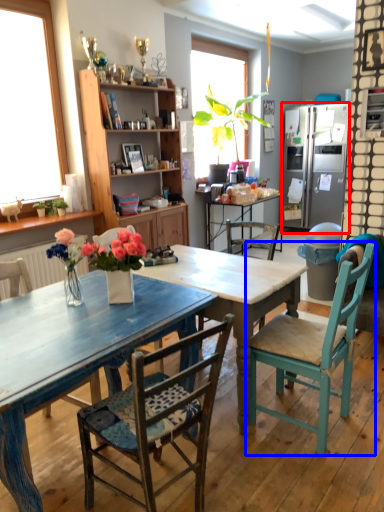
Question: Which object appears farthest to the camera in this image, refrigerator (highlighted by a red box) or chair (highlighted by a blue box)?

Choices:
 (A) refrigerator
 (B) chair

Answer: (A)